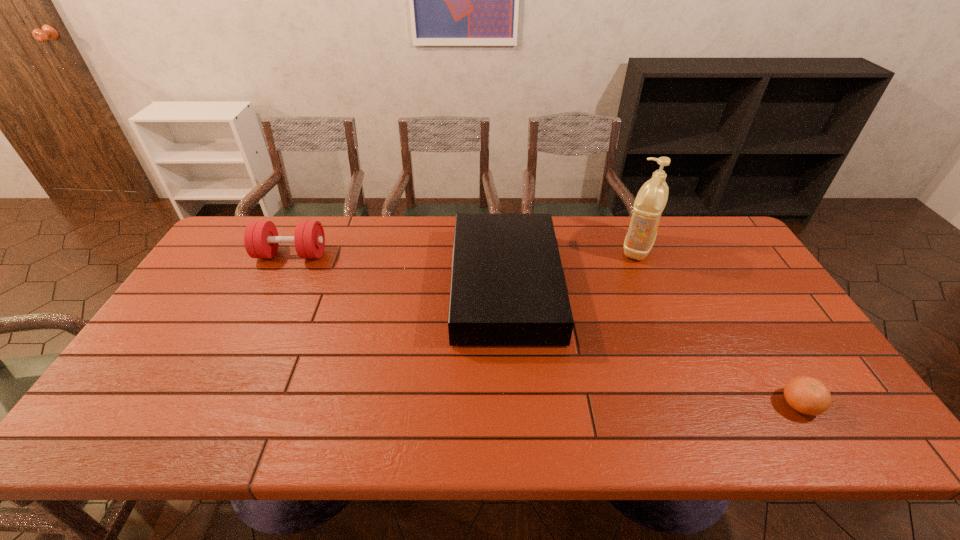
This screenshot has height=540, width=960. I want to click on object that is at the far left corner, so click(261, 240).

The width and height of the screenshot is (960, 540). I want to click on object present at the near right corner, so click(807, 395).

In the image, there is a desktop. In order to click on vacant space at the far edge in this screenshot , I will do `click(377, 254)`.

This screenshot has width=960, height=540. In order to click on vacant space at the near edge of the desktop in this screenshot , I will do `click(520, 435)`.

Image resolution: width=960 pixels, height=540 pixels. In the image, there is a desktop. Find the location of `vacant space at the left edge`. vacant space at the left edge is located at coordinates (174, 323).

The width and height of the screenshot is (960, 540). Find the location of `vacant space at the right edge of the desktop`. vacant space at the right edge of the desktop is located at coordinates (734, 264).

Identify the location of free space between the dumbbell and the second shortest object. (398, 270).

The height and width of the screenshot is (540, 960). I want to click on empty space between the shortest object and the detergent, so click(718, 326).

Where is `vacant point located between the second shortest object and the rightmost object`? Image resolution: width=960 pixels, height=540 pixels. vacant point located between the second shortest object and the rightmost object is located at coordinates (653, 345).

Find the location of a particular element. This screenshot has height=540, width=960. vacant space in between the rightmost object and the CD player is located at coordinates (653, 345).